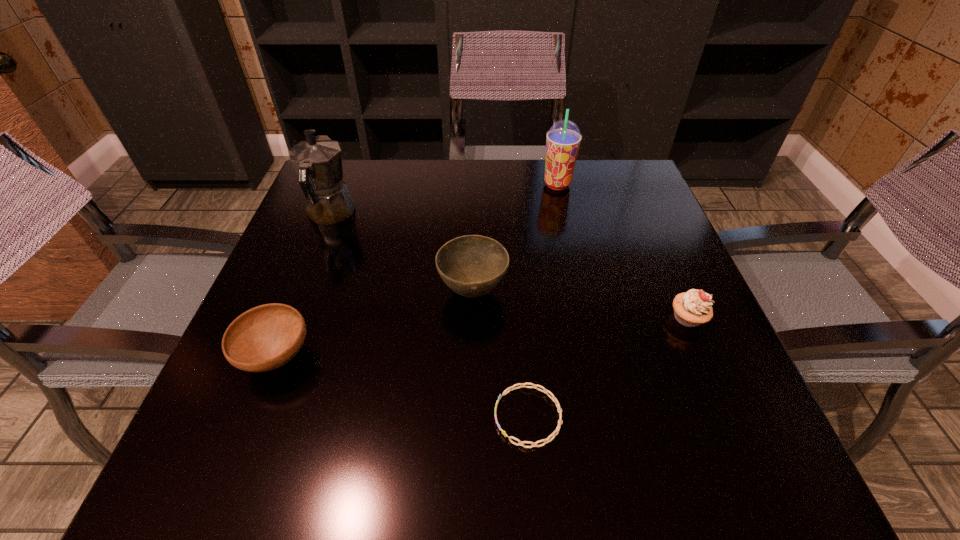
Image resolution: width=960 pixels, height=540 pixels. Identify the location of free space that satisfies the following two spatial constraints: 1. on the back side of the fifth object from left to right; 2. on the right side of the left bowl. (344, 185).